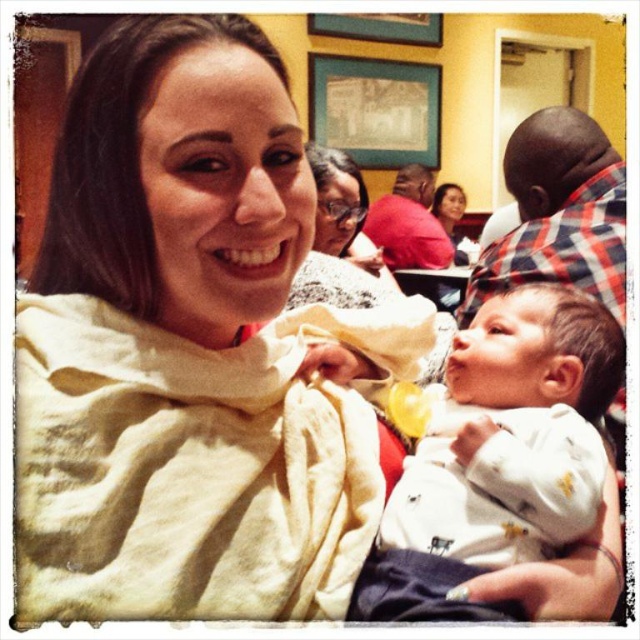
Question: Observing the image, what is the correct spatial positioning of white soft fabric baby at center in reference to white matte arm at center?

Choices:
 (A) above
 (B) below

Answer: (A)

Question: Which point is closer to the camera taking this photo?

Choices:
 (A) (602, 586)
 (B) (64, 506)
 (C) (563, 317)

Answer: (B)

Question: Based on their relative distances, which object is farther from the white matte arm at center?

Choices:
 (A) white soft fabric baby at center
 (B) white soft scarf at center

Answer: (B)

Question: Is white soft scarf at center above white soft fabric baby at center?

Choices:
 (A) no
 (B) yes

Answer: (B)

Question: Observing the image, what is the correct spatial positioning of white soft fabric baby at center in reference to white matte arm at center?

Choices:
 (A) left
 (B) right

Answer: (A)

Question: Which of the following is the farthest from the observer?

Choices:
 (A) (516, 500)
 (B) (125, 536)

Answer: (A)